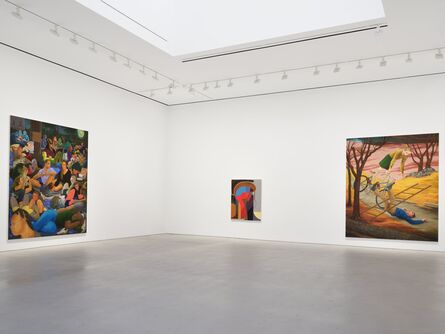
This screenshot has height=334, width=445. In order to click on right painting in this screenshot , I will do `click(394, 192)`.